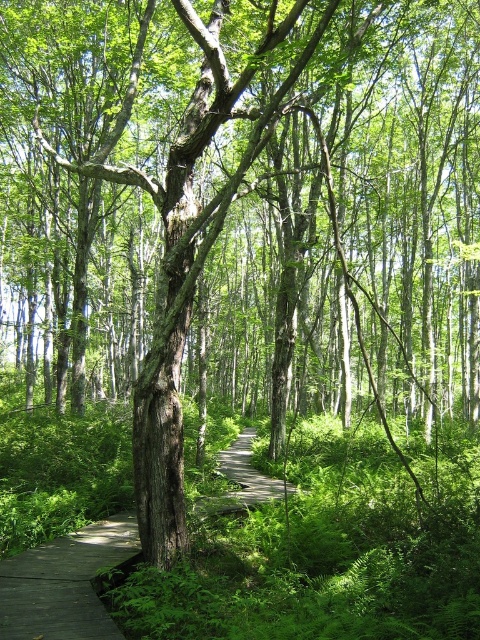
You are a hiker carrying a large backpack and want to walk on the wooden at center and the wooden boardwalk at center. Which path is wider so you can walk comfortably?

The wooden at center is wider than the wooden boardwalk at center, so it is better for walking with a large backpack.

You are a hiker standing on the wooden boardwalk at center. You want to step onto the wooden at center to pick up a fallen berry. Is there enough space to move freely between them?

The wooden at center occupies less space than the wooden boardwalk at center, so there might not be enough space to move freely between them. Be cautious when stepping over.

You are standing on the wooden boardwalk at center and want to walk to the wooden at center. Which direction should you face to reach it?

The wooden at center is to the left of the wooden boardwalk at center, so you should face left to reach it.